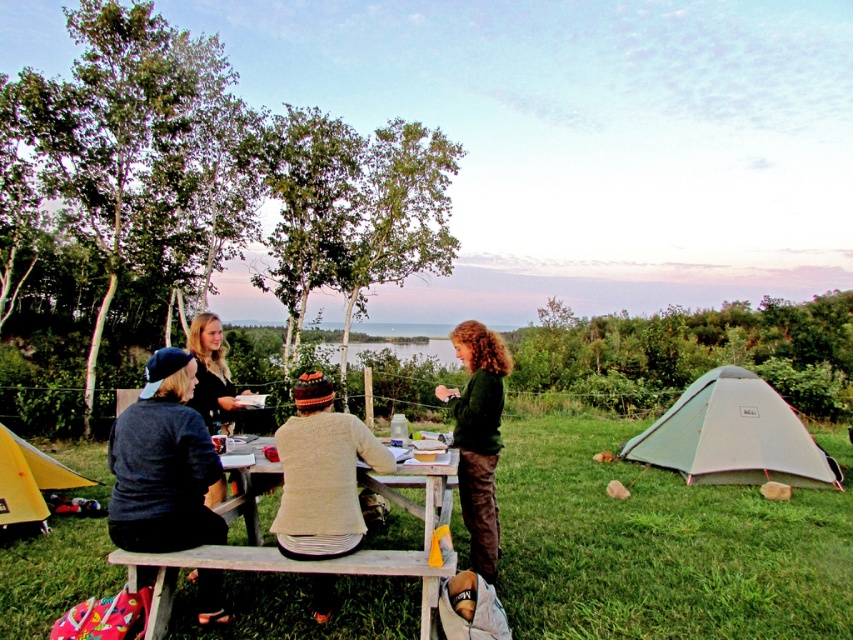
Question: Is dark gray sweater at lower left positioned in front of black fabric shirt at center?

Choices:
 (A) yes
 (B) no

Answer: (A)

Question: Can you confirm if dark gray sweater at lower left is positioned to the left of black fabric shirt at center?

Choices:
 (A) no
 (B) yes

Answer: (A)

Question: Which of the following is the closest to the observer?

Choices:
 (A) knitted beige sweater at center
 (B) wooden picnic table at center
 (C) dark gray sweater at lower left
 (D) white fabric tent at right

Answer: (B)

Question: Which point is closer to the camera?

Choices:
 (A) wooden picnic table at center
 (B) dark green sweater at center
 (C) yellow fabric tent at lower left

Answer: (A)

Question: Estimate the real-world distances between objects in this image. Which object is closer to the dark gray sweater at lower left?

Choices:
 (A) yellow fabric tent at lower left
 (B) white fabric tent at right
 (C) dark green sweater at center

Answer: (C)

Question: Is dark gray sweater at lower left wider than wooden picnic table at center?

Choices:
 (A) no
 (B) yes

Answer: (A)